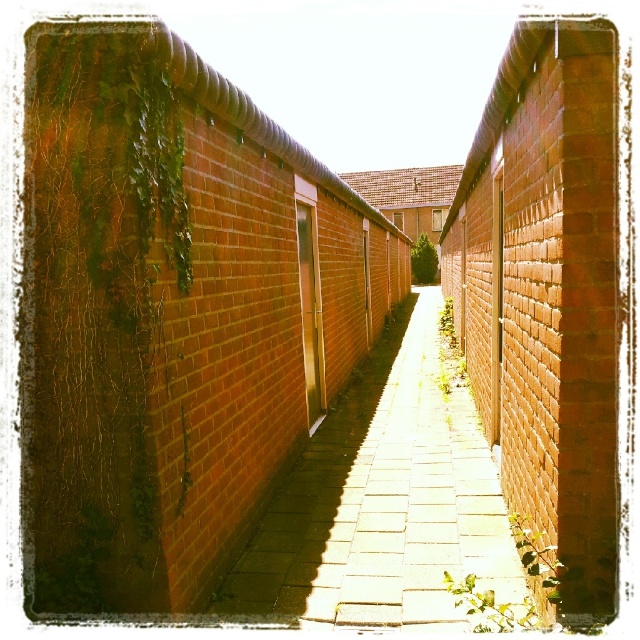
At what (x,y) coordinates should I click in order to perform the action: click on green leafy ivy at left. Please return your answer as a coordinate pair (x, y). Image resolution: width=640 pixels, height=640 pixels. Looking at the image, I should click on (99, 310).

From the picture: Between green leafy ivy at left and brick paved path at center, which one has more height?

green leafy ivy at left is taller.

Is point (120, 35) closer to viewer compared to point (433, 332)?

Yes, it is.

Locate an element on the screen. The width and height of the screenshot is (640, 640). green leafy ivy at left is located at coordinates (99, 310).